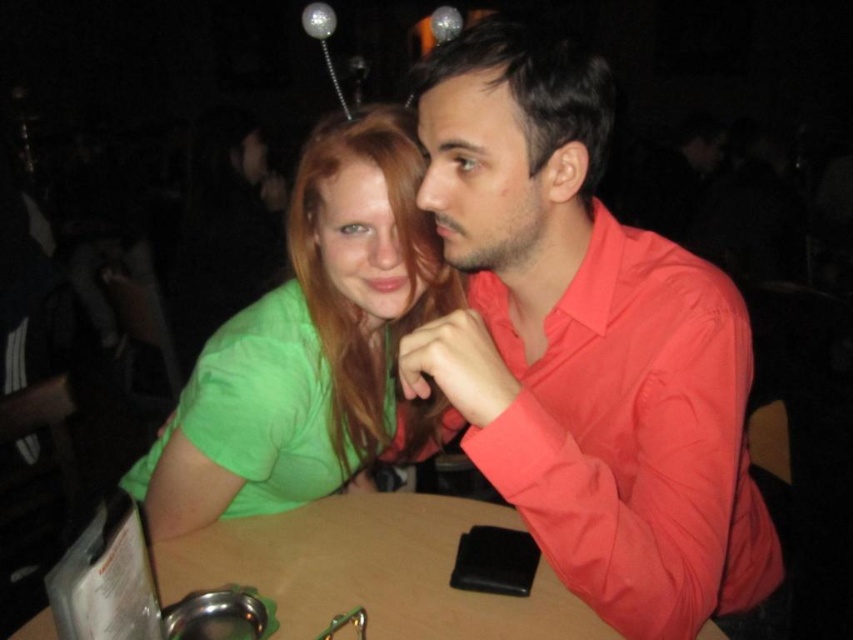
You are trying to place a rectangular gift box that is 1 meter wide on the brown wooden table at center. Considering the matte red shirt at center is also on the table, will the gift box fit on the table without overlapping the shirt?

The matte red shirt at center has a lesser width compared to brown wooden table at center, so the gift box that is 1 meter wide might fit on the brown wooden table at center if there is enough space around the shirt. However, since the shirt is on the table, you need to ensure there is sufficient space between them to avoid overlapping.

You are a photographer trying to capture a candid shot of the green matte shirt at center and the brown wooden table at center. Since you want to ensure both subjects are in focus, you need to know their relative positions. Which object is located to the left of the other?

The green matte shirt at center is positioned on the left side of brown wooden table at center, so the green matte shirt at center is to the left of the brown wooden table at center.

You are a photographer adjusting your camera settings. You want to focus on the green matte shirt at center and the brown wooden table at center. Which object should you adjust your focus to first if you want to capture both in sharp detail?

The green matte shirt at center is closer to the viewer than the brown wooden table at center, so you should focus on the green matte shirt at center first to ensure both are in sharp detail.